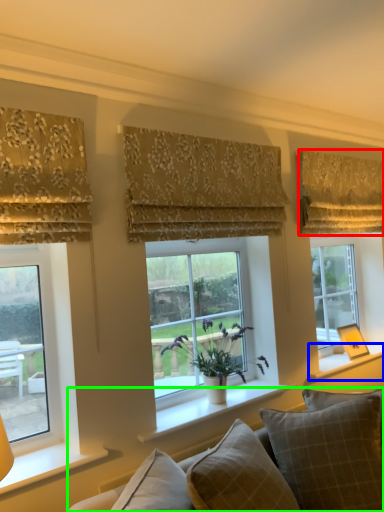
Question: Which object is the closest to the curtain (highlighted by a red box)? Choose among these: window sill (highlighted by a blue box) or studio couch (highlighted by a green box).

Choices:
 (A) window sill
 (B) studio couch

Answer: (A)